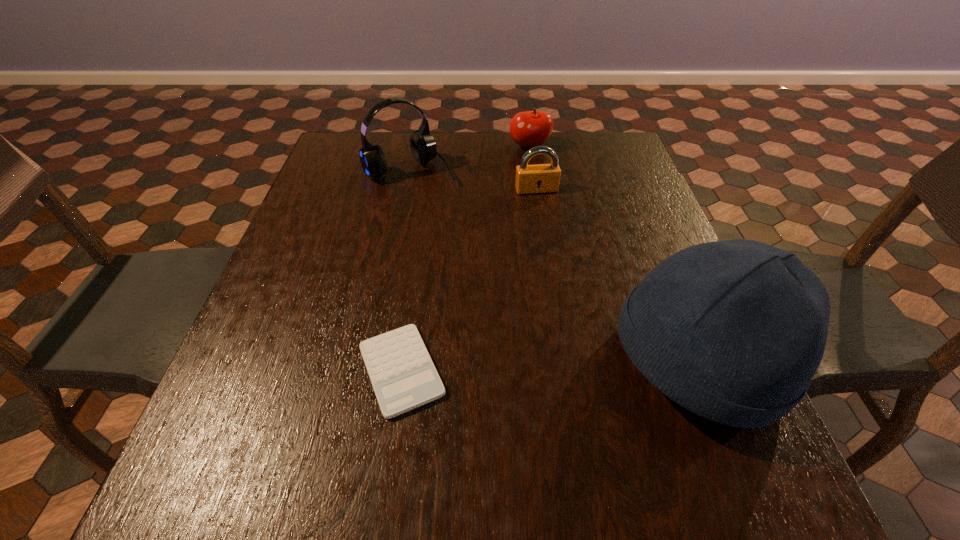
Locate an element on the screen. The image size is (960, 540). calculator is located at coordinates (403, 376).

This screenshot has width=960, height=540. I want to click on the rightmost object, so click(734, 331).

Find the location of `skullcap`. skullcap is located at coordinates (734, 331).

Locate an element on the screen. padlock is located at coordinates (541, 178).

Image resolution: width=960 pixels, height=540 pixels. In order to click on the second tallest object in this screenshot , I will do `click(423, 147)`.

Where is `apple`? apple is located at coordinates point(533,128).

Image resolution: width=960 pixels, height=540 pixels. I want to click on blank space located 0.280m on the right of the shortest object, so click(x=604, y=370).

Where is `vacant space located on the back of the rightmost object`? vacant space located on the back of the rightmost object is located at coordinates (658, 262).

In order to click on vacant region located to unlock the padlock from the front in this screenshot , I will do `click(548, 221)`.

Where is `free space located to unlock the padlock from the front`? The image size is (960, 540). free space located to unlock the padlock from the front is located at coordinates (543, 207).